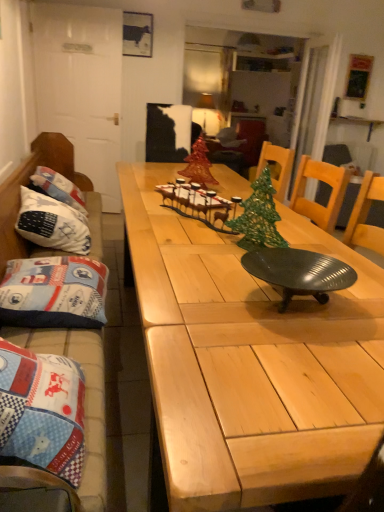
Question: Can you confirm if shiny red glass christmas tree at center, which is the 1th christmas tree in top-to-bottom order, is thinner than blue quilted cushion at left?

Choices:
 (A) no
 (B) yes

Answer: (B)

Question: Is shiny red glass christmas tree at center, which appears as the 2th christmas tree when ordered from the bottom, closer to camera compared to blue quilted cushion at left?

Choices:
 (A) no
 (B) yes

Answer: (A)

Question: Is shiny red glass christmas tree at center, the second christmas tree from the front, smaller than blue quilted cushion at left?

Choices:
 (A) no
 (B) yes

Answer: (B)

Question: From the image's perspective, is shiny red glass christmas tree at center, which is the second christmas tree in right-to-left order, beneath blue quilted cushion at left?

Choices:
 (A) yes
 (B) no

Answer: (B)

Question: Looking at their shapes, would you say blue quilted cushion at left is wider or thinner than white fabric pillow at left, positioned as the 2th pillow in front-to-back order?

Choices:
 (A) wide
 (B) thin

Answer: (A)

Question: From the image's perspective, is blue quilted cushion at left positioned above or below white fabric pillow at left, positioned as the 2th pillow in front-to-back order?

Choices:
 (A) above
 (B) below

Answer: (B)

Question: Do you think blue quilted cushion at left is within white fabric pillow at left, positioned as the 2th pillow in front-to-back order, or outside of it?

Choices:
 (A) inside
 (B) outside

Answer: (B)

Question: Is point (92, 334) closer or farther from the camera than point (44, 207)?

Choices:
 (A) farther
 (B) closer

Answer: (B)

Question: Is point (380, 415) closer or farther from the camera than point (322, 288)?

Choices:
 (A) farther
 (B) closer

Answer: (B)

Question: Choose the correct answer: Is natural wood table at center inside metallic dark green tray at center or outside it?

Choices:
 (A) inside
 (B) outside

Answer: (B)

Question: Considering the relative positions of natural wood table at center and metallic dark green tray at center in the image provided, is natural wood table at center to the left or to the right of metallic dark green tray at center?

Choices:
 (A) left
 (B) right

Answer: (A)

Question: From the image's perspective, is natural wood table at center located above or below metallic dark green tray at center?

Choices:
 (A) above
 (B) below

Answer: (B)

Question: In the image, is green metallic christmas tree at center, acting as the 2th christmas tree starting from the top, on the left side or the right side of white fabric pillow at left, which is counted as the first pillow, starting from the back?

Choices:
 (A) right
 (B) left

Answer: (A)

Question: In the image, is green metallic christmas tree at center, placed as the 1th christmas tree when sorted from front to back, positioned in front of or behind white fabric pillow at left, positioned as the 2th pillow in front-to-back order?

Choices:
 (A) front
 (B) behind

Answer: (A)